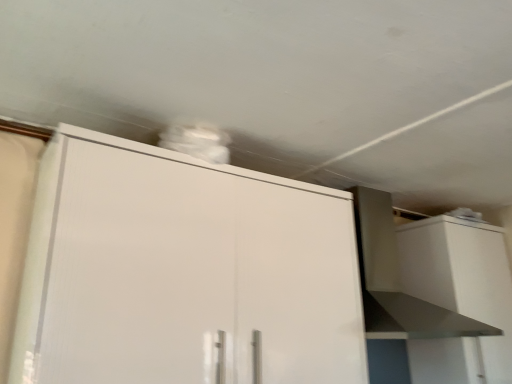
Question: In terms of width, does white glossy cabinet at upper center, positioned as the first cabinetry in left-to-right order, look wider or thinner when compared to white matte cabinet at right, placed as the 1th cabinetry when sorted from back to front?

Choices:
 (A) thin
 (B) wide

Answer: (B)

Question: Is white glossy cabinet at upper center, which appears as the 1th cabinetry when viewed from the front, in front of or behind white matte cabinet at right, which ranks as the first cabinetry in right-to-left order, in the image?

Choices:
 (A) behind
 (B) front

Answer: (B)

Question: Based on their relative distances, which object is nearer to the white matte vent at upper right?

Choices:
 (A) white glossy cabinet at upper center, marked as the second cabinetry in a back-to-front arrangement
 (B) white matte cabinet at right, which is the 2th cabinetry from front to back

Answer: (B)

Question: Which object is the farthest from the white matte vent at upper right?

Choices:
 (A) white glossy cabinet at upper center, arranged as the second cabinetry when viewed from the right
 (B) white matte cabinet at right, which ranks as the first cabinetry in right-to-left order

Answer: (A)